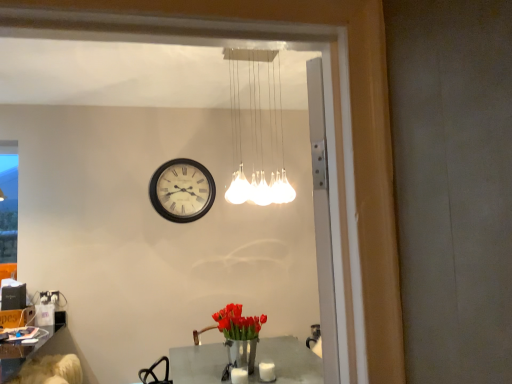
You are a GUI agent. You are given a task and a screenshot of the screen. Output one action in this format:
    pyautogui.click(x=<x>, y=<y>)
    Task: Click on the shiny metallic vase with red tulips at center
    The height and width of the screenshot is (384, 512).
    Given the screenshot: What is the action you would take?
    pyautogui.click(x=239, y=336)

In order to face white matte candle at lower center, the first candle from the right, should I rotate leftwards or rightwards?

Turn right by 1.623 degrees to look at white matte candle at lower center, the first candle from the right.

What is the approximate height of white matte candle at lower center, placed as the second candle when sorted from left to right?

3.80 inches.

Describe the element at coordinates (182, 190) in the screenshot. I see `matte black clock at center` at that location.

Describe the element at coordinates (257, 128) in the screenshot. The image size is (512, 384). I see `white glass pendant lights at upper center` at that location.

This screenshot has width=512, height=384. What are the coordinates of `white matte candle at lower center, marked as the second candle in a right-to-left arrangement` in the screenshot? It's located at (239, 376).

What is the approximate width of metallic silver table at center?

metallic silver table at center is 94.42 centimeters wide.

The height and width of the screenshot is (384, 512). What are the coordinates of `shiny metallic vase with red tulips at center` in the screenshot? It's located at (239, 336).

Would you say white glass pendant lights at upper center contains white matte candle at lower center, placed as the second candle when sorted from left to right?

Definitely not — white matte candle at lower center, placed as the second candle when sorted from left to right, is not inside white glass pendant lights at upper center.

Considering their positions, is white glass pendant lights at upper center located in front of or behind white matte candle at lower center, placed as the second candle when sorted from left to right?

Clearly, white glass pendant lights at upper center is in front of white matte candle at lower center, placed as the second candle when sorted from left to right.

Who is shorter, white glass pendant lights at upper center or white matte candle at lower center, the first candle from the right?

white matte candle at lower center, the first candle from the right, is shorter.

From the picture: Is metallic silver table at center at the back of light brown leather swivel chair at lower left?

Yes, light brown leather swivel chair at lower left's orientation is away from metallic silver table at center.

Is metallic silver table at center completely or partially inside light brown leather swivel chair at lower left?

Actually, metallic silver table at center is outside light brown leather swivel chair at lower left.

Considering the relative sizes of light brown leather swivel chair at lower left and metallic silver table at center in the image provided, is light brown leather swivel chair at lower left thinner than metallic silver table at center?

Indeed, light brown leather swivel chair at lower left has a lesser width compared to metallic silver table at center.

Does point (69, 371) appear closer or farther from the camera than point (276, 362)?

Point (69, 371) appears to be farther away from the viewer than point (276, 362).

Where is `swivel chair below the white glass pendant lights at upper center (from the image's perspective)`? The image size is (512, 384). swivel chair below the white glass pendant lights at upper center (from the image's perspective) is located at coordinates (50, 370).

Is point (76, 369) in front of point (263, 111)?

No, (76, 369) is behind (263, 111).

Who is more distant, light brown leather swivel chair at lower left or white glass pendant lights at upper center?

light brown leather swivel chair at lower left is more distant.

Considering the sizes of objects light brown leather swivel chair at lower left and white glass pendant lights at upper center in the image provided, who is wider, light brown leather swivel chair at lower left or white glass pendant lights at upper center?

With larger width is light brown leather swivel chair at lower left.

Who is smaller, shiny metallic vase with red tulips at center or matte black clock at center?

Smaller between the two is matte black clock at center.

Could you tell me if shiny metallic vase with red tulips at center is turned towards matte black clock at center?

No.

This screenshot has height=384, width=512. I want to click on wall clock above the shiny metallic vase with red tulips at center (from the image's perspective), so click(182, 190).

Which object is further away from the camera taking this photo, shiny metallic vase with red tulips at center or matte black clock at center?

matte black clock at center is more distant.

Considering the sizes of objects white matte candle at lower center, marked as the second candle in a right-to-left arrangement, and white glass pendant lights at upper center in the image provided, who is shorter, white matte candle at lower center, marked as the second candle in a right-to-left arrangement, or white glass pendant lights at upper center?

With less height is white matte candle at lower center, marked as the second candle in a right-to-left arrangement.

Can white glass pendant lights at upper center be found inside white matte candle at lower center, marked as the second candle in a right-to-left arrangement?

No, white matte candle at lower center, marked as the second candle in a right-to-left arrangement, does not contain white glass pendant lights at upper center.

Based on their positions, is white matte candle at lower center, the first candle in the left-to-right sequence, located to the left or right of white glass pendant lights at upper center?

From the image, it's evident that white matte candle at lower center, the first candle in the left-to-right sequence, is to the left of white glass pendant lights at upper center.

Is white matte candle at lower center, the first candle in the left-to-right sequence, positioned with its back to white glass pendant lights at upper center?

No.

Is point (278, 203) farther from camera compared to point (302, 361)?

Yes.

From a real-world perspective, is white glass pendant lights at upper center beneath metallic silver table at center?

No, from a real-world perspective, white glass pendant lights at upper center is not under metallic silver table at center.

Measure the distance from white glass pendant lights at upper center to metallic silver table at center.

They are 1.59 meters apart.

Which is more to the right, white glass pendant lights at upper center or metallic silver table at center?

white glass pendant lights at upper center.

Are metallic silver table at center and light brown leather swivel chair at lower left located far from each other?

Yes.

Is metallic silver table at center surrounding light brown leather swivel chair at lower left?

No, light brown leather swivel chair at lower left is not a part of metallic silver table at center.

Consider the image. Could you tell me if metallic silver table at center is turned towards light brown leather swivel chair at lower left?

Yes, metallic silver table at center is facing light brown leather swivel chair at lower left.

Can you confirm if metallic silver table at center is shorter than light brown leather swivel chair at lower left?

In fact, metallic silver table at center may be taller than light brown leather swivel chair at lower left.

The image size is (512, 384). In order to click on candle that appears behind the white glass pendant lights at upper center in this screenshot , I will do `click(267, 371)`.

Where is `swivel chair on the left of metallic silver table at center`? This screenshot has height=384, width=512. swivel chair on the left of metallic silver table at center is located at coordinates (50, 370).

When comparing their distances from shiny metallic vase with red tulips at center, does light brown leather swivel chair at lower left or matte black clock at center seem further?

Among the two, matte black clock at center is located further to shiny metallic vase with red tulips at center.

Looking at the image, which one is located closer to metallic silver table at center, white glass pendant lights at upper center or white matte candle at lower center, placed as the second candle when sorted from left to right?

white matte candle at lower center, placed as the second candle when sorted from left to right, is closer to metallic silver table at center.

Based on their spatial positions, is metallic silver table at center or shiny metallic vase with red tulips at center closer to white glass pendant lights at upper center?

shiny metallic vase with red tulips at center is closer to white glass pendant lights at upper center.

Which object lies nearer to the anchor point white glass pendant lights at upper center, light brown leather swivel chair at lower left or white matte candle at lower center, placed as the second candle when sorted from left to right?

The object closer to white glass pendant lights at upper center is white matte candle at lower center, placed as the second candle when sorted from left to right.

Consider the image. From the image, which object appears to be farther from white matte candle at lower center, marked as the second candle in a right-to-left arrangement, white matte candle at lower center, the first candle from the right, or metallic silver table at center?

metallic silver table at center is further to white matte candle at lower center, marked as the second candle in a right-to-left arrangement.

Based on their spatial positions, is matte black clock at center or light brown leather swivel chair at lower left further from white glass pendant lights at upper center?

Among the two, light brown leather swivel chair at lower left is located further to white glass pendant lights at upper center.

When comparing their distances from shiny metallic vase with red tulips at center, does white glass pendant lights at upper center or metallic silver table at center seem further?

The object further to shiny metallic vase with red tulips at center is white glass pendant lights at upper center.

From the image, which object appears to be nearer to white matte candle at lower center, the first candle from the right, white glass pendant lights at upper center or white matte candle at lower center, the first candle in the left-to-right sequence?

white matte candle at lower center, the first candle in the left-to-right sequence.

Find the location of a particular element. candle between white matte candle at lower center, the first candle in the left-to-right sequence, and matte black clock at center from front to back is located at coordinates (267, 371).

You are a GUI agent. You are given a task and a screenshot of the screen. Output one action in this format:
    pyautogui.click(x=<x>, y=<y>)
    Task: Click on the floral arrangement between light brown leather swivel chair at lower left and white matte candle at lower center, the first candle in the left-to-right sequence, from left to right
    The height and width of the screenshot is (384, 512).
    Given the screenshot: What is the action you would take?
    click(x=239, y=336)

Locate an element on the screen. The height and width of the screenshot is (384, 512). floral arrangement that lies between white glass pendant lights at upper center and light brown leather swivel chair at lower left from top to bottom is located at coordinates (239, 336).

Locate an element on the screen. floral arrangement between white matte candle at lower center, the first candle from the right, and matte black clock at center in the front-back direction is located at coordinates (239, 336).